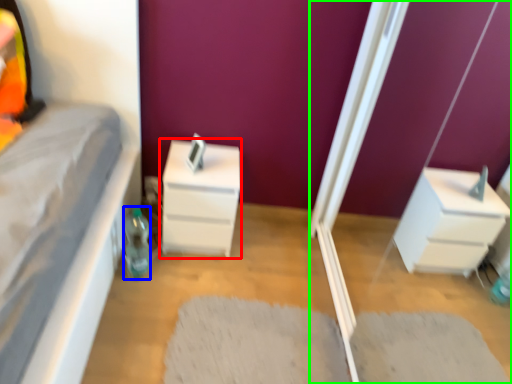
Question: Which object is positioned farthest from chest of drawers (highlighted by a red box)? Select from bottle (highlighted by a blue box) and screen door (highlighted by a green box).

Choices:
 (A) bottle
 (B) screen door

Answer: (B)